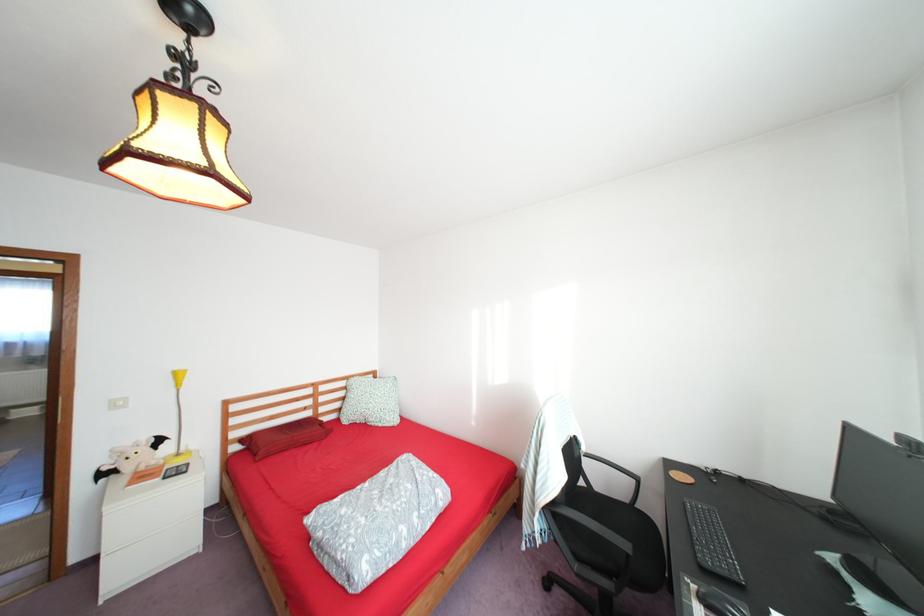
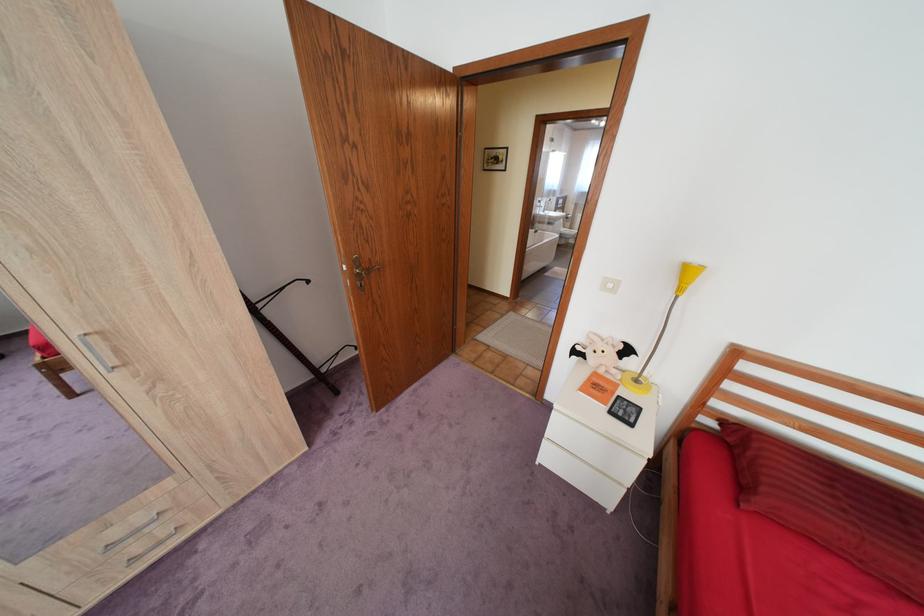
Locate, in the second image, the point that corresponds to [188,471] in the first image.

(636, 411)